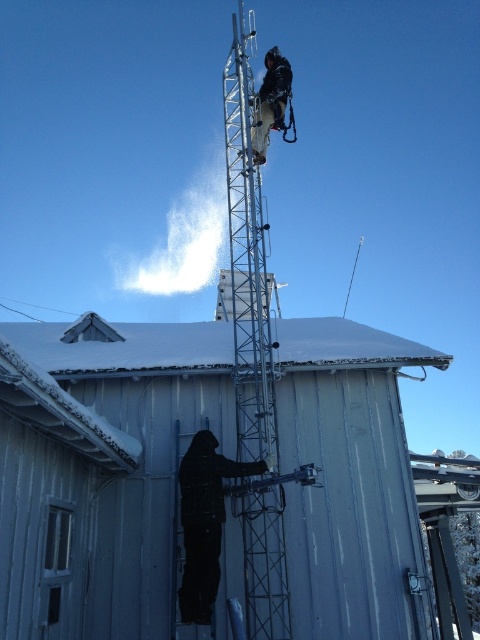
Between metallic blue hut at lower center and white snow-covered roof at center, which one appears on the left side from the viewer's perspective?

Positioned to the left is metallic blue hut at lower center.

Between point (71, 419) and point (327, 353), which one is positioned behind?

Point (327, 353)

Identify the location of metallic blue hut at lower center. tap(100, 468).

Can you confirm if white snow-covered roof at center is taller than dark brown leather jacket at upper center?

Incorrect, white snow-covered roof at center's height is not larger of dark brown leather jacket at upper center's.

Does white snow-covered roof at center have a smaller size compared to dark brown leather jacket at upper center?

Actually, white snow-covered roof at center might be larger than dark brown leather jacket at upper center.

What do you see at coordinates (121, 346) in the screenshot?
I see `white snow-covered roof at center` at bounding box center [121, 346].

What are the coordinates of `white snow-covered roof at center` in the screenshot? It's located at (121, 346).

Which of these two, black matte jacket at center or dark brown leather jacket at upper center, stands taller?

black matte jacket at center

At what (x,y) coordinates should I click in order to perform the action: click on black matte jacket at center. Please return your answer as a coordinate pair (x, y). The width and height of the screenshot is (480, 640). Looking at the image, I should click on point(204,522).

Locate an element on the screen. The height and width of the screenshot is (640, 480). black matte jacket at center is located at coordinates (204, 522).